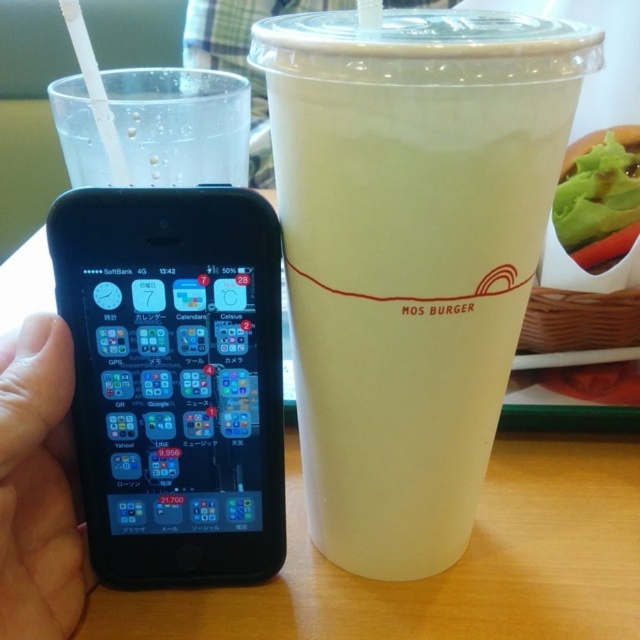
Question: Which of these objects is positioned closest to the green leafy vegetable at upper right?

Choices:
 (A) matte black phone at lower left
 (B) white plastic straw at upper left
 (C) wooden table at center
 (D) black matte smartphone at left

Answer: (C)

Question: Is black matte smartphone at left in front of green leafy vegetable at upper right?

Choices:
 (A) yes
 (B) no

Answer: (A)

Question: Is wooden table at center above matte black phone at lower left?

Choices:
 (A) yes
 (B) no

Answer: (B)

Question: Which point is farther to the camera?

Choices:
 (A) white opaque cup at center
 (B) matte black phone at lower left

Answer: (B)

Question: Is matte black phone at lower left to the left of clear plastic cup at left from the viewer's perspective?

Choices:
 (A) yes
 (B) no

Answer: (A)

Question: Which of these objects is positioned farthest from the white opaque cup at center?

Choices:
 (A) clear plastic cup at left
 (B) matte black phone at lower left

Answer: (A)